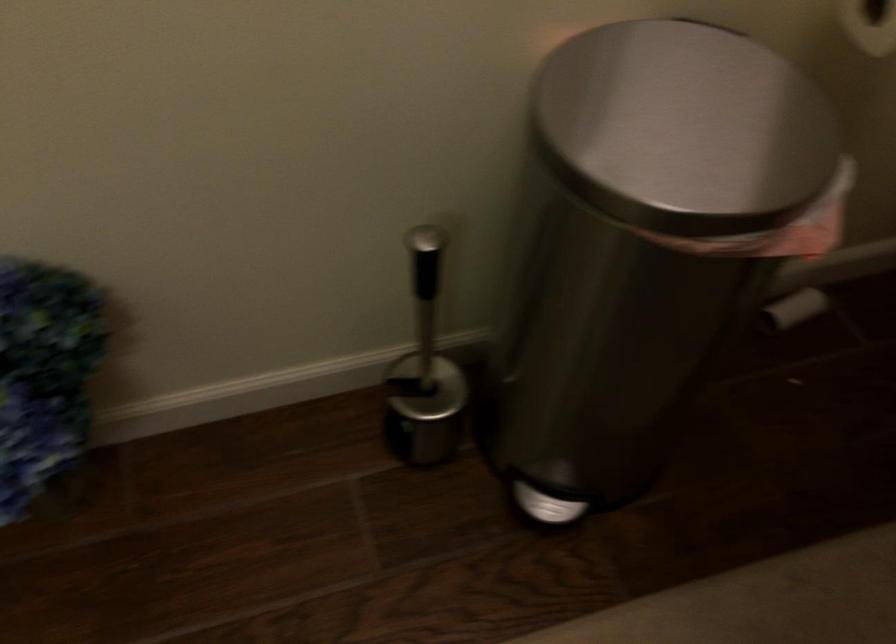
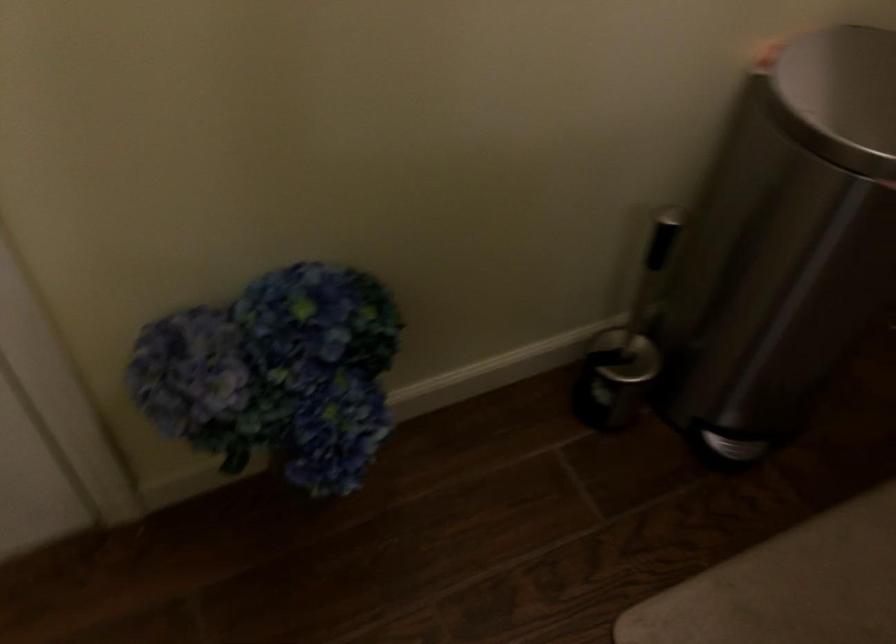
Where in the second image is the point corresponding to pixel 425 299 from the first image?

(650, 270)